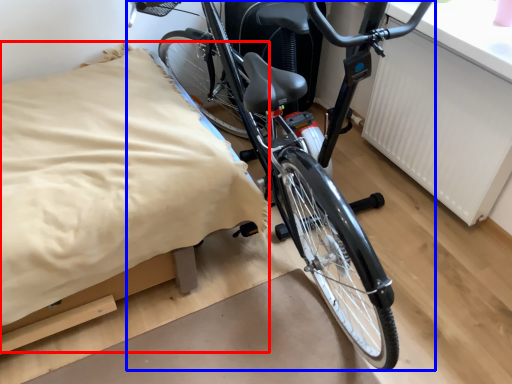
Question: Which of the following is the closest to the observer, sheet (highlighted by a red box) or bicycle (highlighted by a blue box)?

Choices:
 (A) sheet
 (B) bicycle

Answer: (B)